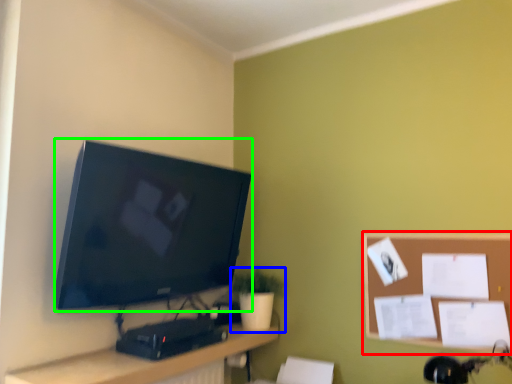
Question: Which is farther away from bulletin board (highlighted by a red box)? houseplant (highlighted by a blue box) or television (highlighted by a green box)?

Choices:
 (A) houseplant
 (B) television

Answer: (B)